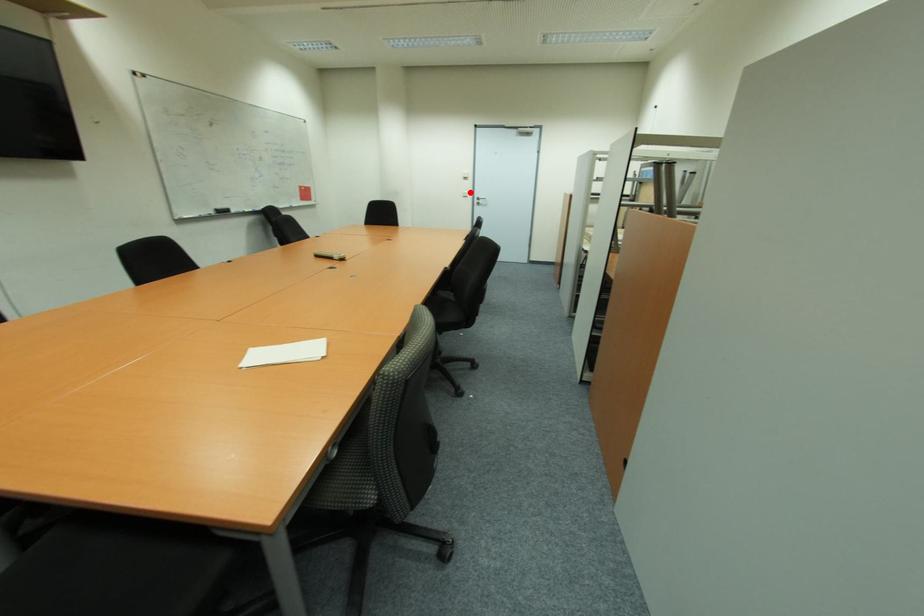
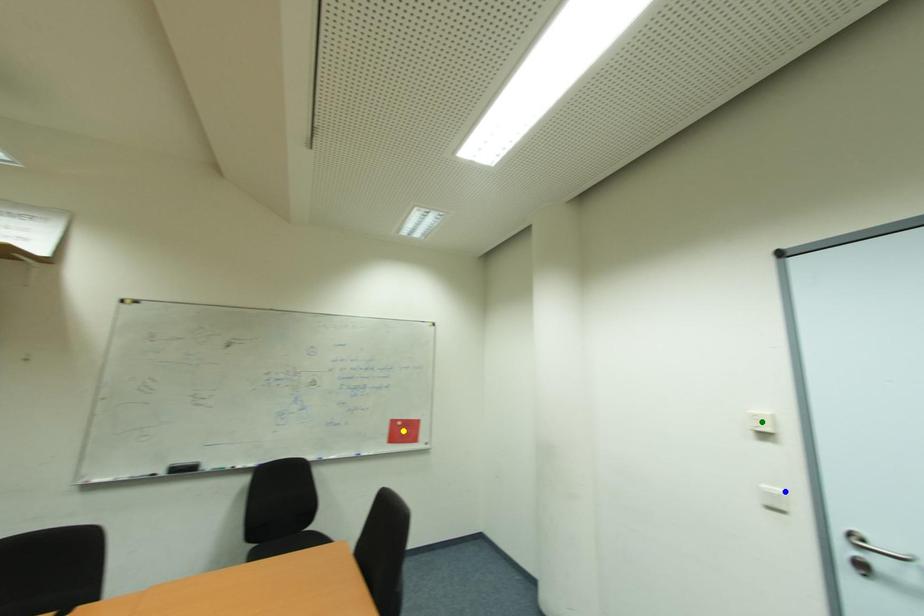
Question: I am providing you with two images of the same scene from different viewpoints. A red point is marked on the first image. You are given multiple points on the second image. Which point in image 2 represents the same 3d spot as the red point in image 1?

Choices:
 (A) blue point
 (B) yellow point
 (C) green point

Answer: (A)